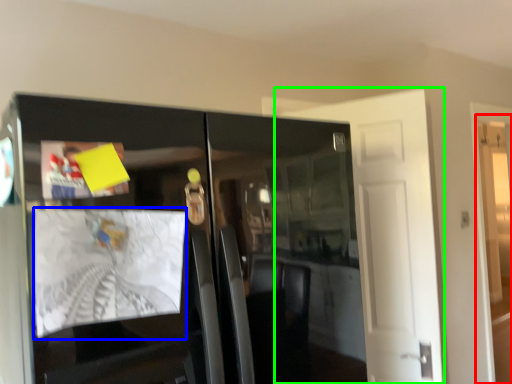
Question: Which object is the farthest from door (highlighted by a red box)? Choose among these: magazine (highlighted by a blue box) or door (highlighted by a green box).

Choices:
 (A) magazine
 (B) door

Answer: (A)